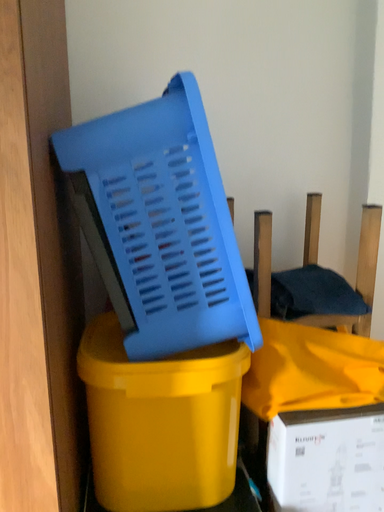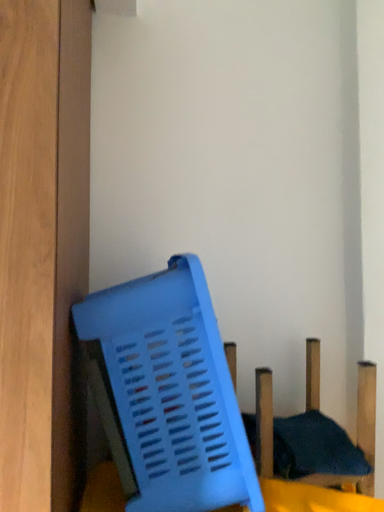
Question: Which way did the camera rotate in the video?

Choices:
 (A) rotated downward
 (B) rotated upward

Answer: (B)